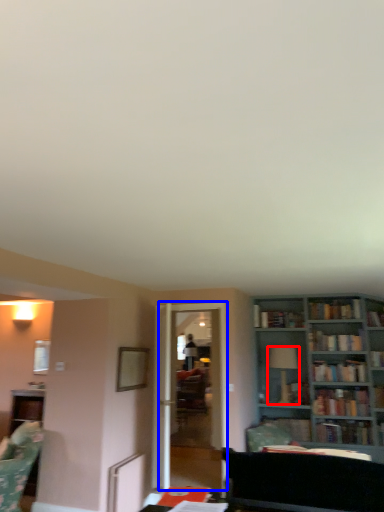
Question: Which object appears farthest to the camera in this image, fixture (highlighted by a red box) or glass door (highlighted by a blue box)?

Choices:
 (A) fixture
 (B) glass door

Answer: (A)